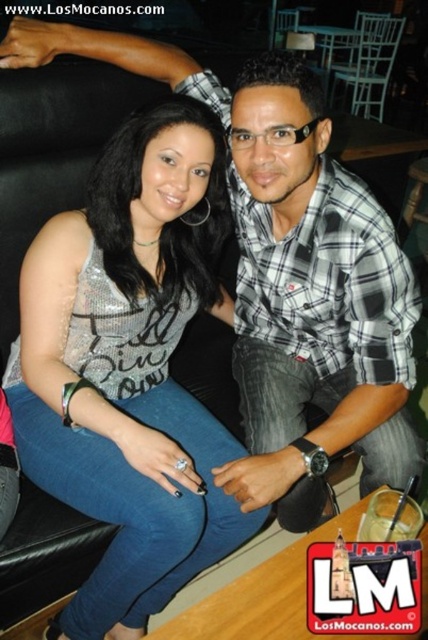
Question: Is satin silver tank top at center above plaid cotton shirt at center?

Choices:
 (A) no
 (B) yes

Answer: (A)

Question: Which point is farther to the camera?

Choices:
 (A) plaid cotton shirt at center
 (B) satin silver tank top at center

Answer: (B)

Question: Does satin silver tank top at center have a smaller size compared to plaid cotton shirt at center?

Choices:
 (A) no
 (B) yes

Answer: (A)

Question: Among these objects, which one is farthest from the camera?

Choices:
 (A) satin silver tank top at center
 (B) plaid cotton shirt at center

Answer: (A)

Question: Does satin silver tank top at center appear under plaid cotton shirt at center?

Choices:
 (A) no
 (B) yes

Answer: (B)